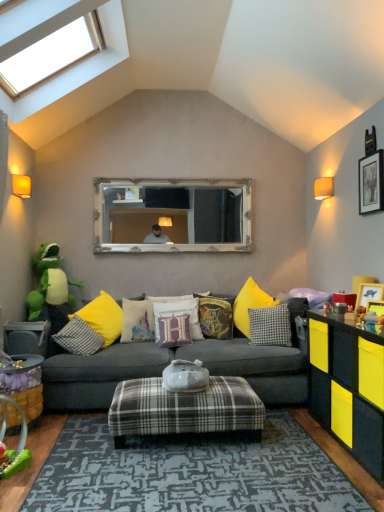
The height and width of the screenshot is (512, 384). What do you see at coordinates (103, 317) in the screenshot?
I see `yellow fabric pillow at center, the sixth pillow when ordered from right to left` at bounding box center [103, 317].

Locate an element on the screen. yellow fabric pillow at center, marked as the 2th pillow in a left-to-right arrangement is located at coordinates (103, 317).

In order to face dark gray fabric couch at center, should I rotate leftwards or rightwards?

Turn left by 1.863 degrees to look at dark gray fabric couch at center.

What is the approximate width of velvet harry potter cushion at center, the fifth pillow when ordered from left to right?

The width of velvet harry potter cushion at center, the fifth pillow when ordered from left to right, is 8.65 inches.

How much space does checkered fabric pillow at center, arranged as the 7th pillow when viewed from the right, occupy horizontally?

It is 15.22 inches.

Measure the distance between point (x=182, y=333) and camera.

A distance of 3.82 meters exists between point (x=182, y=333) and camera.

Where is `plaid fabric ottoman at center`? The width and height of the screenshot is (384, 512). plaid fabric ottoman at center is located at coordinates (185, 409).

Considering the sizes of objects wooden framed picture at upper right, which is the 3th picture frame from front to back, and yellow matte picture frame at right, the third picture frame in the top-to-bottom sequence, in the image provided, who is thinner, wooden framed picture at upper right, which is the 3th picture frame from front to back, or yellow matte picture frame at right, the third picture frame in the top-to-bottom sequence,?

wooden framed picture at upper right, which is the 3th picture frame from front to back.

From the image's perspective, is wooden framed picture at upper right, which is counted as the 1th picture frame, starting from the top, beneath yellow matte picture frame at right, the first picture frame from the bottom?

No, from the image's perspective, wooden framed picture at upper right, which is counted as the 1th picture frame, starting from the top, is not beneath yellow matte picture frame at right, the first picture frame from the bottom.

Is wooden framed picture at upper right, the 1th picture frame from the back, not inside yellow matte picture frame at right, the third picture frame in the top-to-bottom sequence?

Yes, wooden framed picture at upper right, the 1th picture frame from the back, is outside of yellow matte picture frame at right, the third picture frame in the top-to-bottom sequence.

Is wooden framed picture at upper right, which is counted as the 1th picture frame, starting from the top, closer to camera compared to yellow matte picture frame at right, arranged as the 3th picture frame when viewed from the back?

No, wooden framed picture at upper right, which is counted as the 1th picture frame, starting from the top, is behind yellow matte picture frame at right, arranged as the 3th picture frame when viewed from the back.

Is wooden framed picture at upper right, placed as the third picture frame when sorted from bottom to top, looking in the opposite direction of green plush toy at left?

No, wooden framed picture at upper right, placed as the third picture frame when sorted from bottom to top, is not facing away from green plush toy at left.

Who is taller, wooden framed picture at upper right, which is counted as the 1th picture frame, starting from the top, or green plush toy at left?

Standing taller between the two is green plush toy at left.

From a real-world perspective, which is physically below, wooden framed picture at upper right, the 1th picture frame from the back, or green plush toy at left?

From a 3D spatial view, green plush toy at left is below.

Is wooden framed picture at upper right, placed as the third picture frame when sorted from bottom to top, beside green plush toy at left?

No, wooden framed picture at upper right, placed as the third picture frame when sorted from bottom to top, is not touching green plush toy at left.

From a real-world perspective, is wooden textured basket at lower left, which ranks as the first table in front-to-back order, on plaid fabric ottoman at center?

Yes, from a real-world perspective, wooden textured basket at lower left, which ranks as the first table in front-to-back order, is on top of plaid fabric ottoman at center.

Considering the sizes of wooden textured basket at lower left, marked as the 2th table in a top-to-bottom arrangement, and plaid fabric ottoman at center in the image, is wooden textured basket at lower left, marked as the 2th table in a top-to-bottom arrangement, bigger or smaller than plaid fabric ottoman at center?

Considering their sizes, wooden textured basket at lower left, marked as the 2th table in a top-to-bottom arrangement, takes up less space than plaid fabric ottoman at center.

Who is taller, wooden textured basket at lower left, which ranks as the first table in front-to-back order, or plaid fabric ottoman at center?

With more height is wooden textured basket at lower left, which ranks as the first table in front-to-back order.

In the scene shown: Is metallic silver tray at lower left, the second table positioned from the front, not close to checkered fabric pillow at center, which is the first pillow from right to left?

Indeed, metallic silver tray at lower left, the second table positioned from the front, is not near checkered fabric pillow at center, which is the first pillow from right to left.

From the image's perspective, is metallic silver tray at lower left, arranged as the first table when viewed from the top, below checkered fabric pillow at center, which is the first pillow from right to left?

Yes, from the image's perspective, metallic silver tray at lower left, arranged as the first table when viewed from the top, is beneath checkered fabric pillow at center, which is the first pillow from right to left.

Could you tell me if metallic silver tray at lower left, acting as the 1th table starting from the back, is turned towards checkered fabric pillow at center, which is the first pillow from right to left?

Yes, metallic silver tray at lower left, acting as the 1th table starting from the back, is turned towards checkered fabric pillow at center, which is the first pillow from right to left.

Can you confirm if metallic silver tray at lower left, the second table positioned from the front, is thinner than checkered fabric pillow at center, positioned as the 7th pillow in left-to-right order?

In fact, metallic silver tray at lower left, the second table positioned from the front, might be wider than checkered fabric pillow at center, positioned as the 7th pillow in left-to-right order.

Considering the relative sizes of dark gray fabric couch at center and checkered fabric pillow at center, positioned as the 7th pillow in left-to-right order, in the image provided, is dark gray fabric couch at center taller than checkered fabric pillow at center, positioned as the 7th pillow in left-to-right order,?

Yes.

How different are the orientations of dark gray fabric couch at center and checkered fabric pillow at center, positioned as the 7th pillow in left-to-right order, in degrees?

The facing directions of dark gray fabric couch at center and checkered fabric pillow at center, positioned as the 7th pillow in left-to-right order, are 28.6 degrees apart.

In terms of size, does dark gray fabric couch at center appear bigger or smaller than checkered fabric pillow at center, which is the first pillow from right to left?

Clearly, dark gray fabric couch at center is larger in size than checkered fabric pillow at center, which is the first pillow from right to left.

From a real-world perspective, who is located higher, dark gray fabric couch at center or checkered fabric pillow at center, positioned as the 7th pillow in left-to-right order?

In real-world perspective, checkered fabric pillow at center, positioned as the 7th pillow in left-to-right order, is above.

From a real-world perspective, is checkered fabric pillow at center, positioned as the 7th pillow in left-to-right order, positioned over velvet harry potter-themed pillow at center, which appears as the 2th pillow when viewed from the right, based on gravity?

No, from a real-world perspective, checkered fabric pillow at center, positioned as the 7th pillow in left-to-right order, is not over velvet harry potter-themed pillow at center, which appears as the 2th pillow when viewed from the right

How many degrees apart are the facing directions of checkered fabric pillow at center, which is the first pillow from right to left, and velvet harry potter-themed pillow at center, acting as the sixth pillow starting from the left?

There is a 0.00619-degree angle between the facing directions of checkered fabric pillow at center, which is the first pillow from right to left, and velvet harry potter-themed pillow at center, acting as the sixth pillow starting from the left.

The image size is (384, 512). I want to click on the 2nd pillow below the velvet harry potter-themed pillow at center, which appears as the 2th pillow when viewed from the right (from a real-world perspective), so click(270, 326).

Considering the positions of points (55, 267) and (362, 191), is point (55, 267) farther from camera compared to point (362, 191)?

Yes, it is behind point (362, 191).

Locate an element on the screen. The width and height of the screenshot is (384, 512). picture frame positioned vertically above the green plush toy at left (from a real-world perspective) is located at coordinates (371, 183).

Is green plush toy at left located outside wooden framed picture at upper right, placed as the third picture frame when sorted from bottom to top?

Yes, green plush toy at left is outside of wooden framed picture at upper right, placed as the third picture frame when sorted from bottom to top.

Which object is wider, green plush toy at left or wooden framed picture at upper right, which is the 3th picture frame from front to back?

green plush toy at left is wider.

Identify the location of the 2nd picture frame behind the yellow matte picture frame at right, the third picture frame in the top-to-bottom sequence. (371, 183).

This screenshot has height=512, width=384. I want to click on picture frame above the green plush toy at left (from a real-world perspective), so pyautogui.click(x=371, y=183).

Which object lies nearer to the anchor point velvet harry potter cushion at center, the fifth pillow when ordered from left to right, wooden picture frame at right, placed as the 2th picture frame when sorted from back to front, or plaid fabric ottoman at center?

plaid fabric ottoman at center.

Looking at this image, from the image, which object appears to be farther from wooden picture frame at right, which appears as the 2th picture frame when viewed from the front, checkered fabric pillow at center, positioned as the 7th pillow in left-to-right order, or green plush toy at left?

Based on the image, green plush toy at left appears to be further to wooden picture frame at right, which appears as the 2th picture frame when viewed from the front.

From the image, which object appears to be nearer to plaid fabric ottoman at center, green plush toy at left or metallic silver tray at lower left, the second table positioned from the bottom?

Among the two, metallic silver tray at lower left, the second table positioned from the bottom, is located nearer to plaid fabric ottoman at center.

Looking at the image, which one is located closer to velvet harry potter-themed pillow at center, acting as the sixth pillow starting from the left, green plush toy at left or metallic silver tray at lower left, arranged as the first table when viewed from the top?

Based on the image, metallic silver tray at lower left, arranged as the first table when viewed from the top, appears to be nearer to velvet harry potter-themed pillow at center, acting as the sixth pillow starting from the left.

Considering their positions, is metallic silver tray at lower left, the second table positioned from the front, positioned further to white fabric pillow with colorful design at center, the third pillow positioned from the left, than velvet purple pillow at center, marked as the fourth pillow in a right-to-left arrangement?

metallic silver tray at lower left, the second table positioned from the front, is positioned further to the anchor white fabric pillow with colorful design at center, the third pillow positioned from the left.

In the scene shown: Looking at the image, which one is located further to white fabric pillow with colorful design at center, the third pillow positioned from the left, transparent glass skylight at upper left or yellow matte picture frame at right, the third picture frame in the top-to-bottom sequence?

transparent glass skylight at upper left is further to white fabric pillow with colorful design at center, the third pillow positioned from the left.

When comparing their distances from velvet harry potter-themed pillow at center, acting as the sixth pillow starting from the left, does wooden framed picture at upper right, which is counted as the 1th picture frame, starting from the top, or wooden picture frame at right, which is the 2th picture frame from bottom to top, seem further?

wooden framed picture at upper right, which is counted as the 1th picture frame, starting from the top, is positioned further to the anchor velvet harry potter-themed pillow at center, acting as the sixth pillow starting from the left.

Looking at the image, which one is located closer to dark gray fabric couch at center, plaid fabric ottoman at center or white fabric pillow with colorful design at center, the fifth pillow viewed from the right?

Among the two, white fabric pillow with colorful design at center, the fifth pillow viewed from the right, is located nearer to dark gray fabric couch at center.

Where is `cabinetry located between yellow fabric pillow at center, marked as the 2th pillow in a left-to-right arrangement, and wooden framed picture at upper right, the 1th picture frame from the back, in the left-right direction`? cabinetry located between yellow fabric pillow at center, marked as the 2th pillow in a left-to-right arrangement, and wooden framed picture at upper right, the 1th picture frame from the back, in the left-right direction is located at coordinates (349, 385).

This screenshot has height=512, width=384. In order to click on picture frame between wooden textured basket at lower left, the first table from the bottom, and wooden picture frame at right, which is the 2th picture frame from bottom to top, in the horizontal direction in this screenshot , I will do click(376, 310).

Image resolution: width=384 pixels, height=512 pixels. In order to click on table between metallic silver tray at lower left, the second table positioned from the bottom, and checkered fabric pillow at center, which is the first pillow from right to left in this screenshot , I will do `click(25, 384)`.

Locate an element on the screen. stool between checkered fabric pillow at center, arranged as the 7th pillow when viewed from the right, and checkered fabric pillow at center, which is the first pillow from right to left, in the horizontal direction is located at coordinates (185, 409).